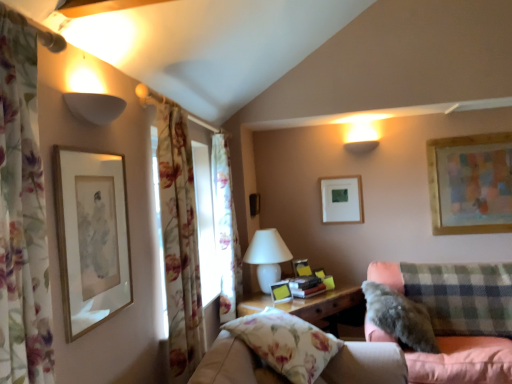
Describe the element at coordinates (225, 230) in the screenshot. I see `floral fabric curtain at center, marked as the third curtain in a front-to-back arrangement` at that location.

This screenshot has width=512, height=384. What do you see at coordinates (281, 292) in the screenshot? I see `matte yellow picture frame at center, the third picture frame in the back-to-front sequence` at bounding box center [281, 292].

Measure the distance between white matte lampshade at upper left and camera.

4.75 feet.

Find the location of a particular element. The width and height of the screenshot is (512, 384). floral fabric curtain at center, the second curtain viewed from the back is located at coordinates (179, 243).

What is the approximate width of floral fabric pillow at lower center, acting as the second studio couch starting from the back?

It is 16.93 inches.

Find the location of `white matte picture frame at upper center, marked as the second picture frame in a right-to-left arrangement`. white matte picture frame at upper center, marked as the second picture frame in a right-to-left arrangement is located at coordinates (341, 199).

Image resolution: width=512 pixels, height=384 pixels. What do you see at coordinates (341, 199) in the screenshot?
I see `white matte picture frame at upper center, the 1th picture frame when ordered from back to front` at bounding box center [341, 199].

Find the location of `floral fabric curtain at center, marked as the first curtain in a back-to-front arrangement`. floral fabric curtain at center, marked as the first curtain in a back-to-front arrangement is located at coordinates (225, 230).

Considering the sizes of objects floral fabric pillow at lower center, acting as the second studio couch starting from the back, and green checkered pillow at right in the image provided, who is bigger, floral fabric pillow at lower center, acting as the second studio couch starting from the back, or green checkered pillow at right?

With larger size is green checkered pillow at right.

Is floral fabric pillow at lower center, which ranks as the first studio couch in front-to-back order, far away from green checkered pillow at right?

Yes, floral fabric pillow at lower center, which ranks as the first studio couch in front-to-back order, and green checkered pillow at right are quite far apart.

Between floral fabric pillow at lower center, which appears as the 2th studio couch when viewed from the right, and green checkered pillow at right, which one appears on the left side from the viewer's perspective?

From the viewer's perspective, floral fabric pillow at lower center, which appears as the 2th studio couch when viewed from the right, appears more on the left side.

In order to click on studio couch above the green checkered pillow at right (from a real-world perspective) in this screenshot , I will do `click(366, 364)`.

In the image, is white ceramic table lamp at center positioned in front of or behind white matte lampshade at upper left?

white ceramic table lamp at center is behind white matte lampshade at upper left.

Does point (286, 258) come closer to viewer compared to point (83, 104)?

No, (286, 258) is further to viewer.

Does white ceramic table lamp at center have a greater width compared to white matte lampshade at upper left?

Yes, white ceramic table lamp at center is wider than white matte lampshade at upper left.

Looking at this image, is fluffy gray pillow at lower right wider or thinner than floral fabric curtain at left, the third curtain positioned from the back?

fluffy gray pillow at lower right is wider than floral fabric curtain at left, the third curtain positioned from the back.

Is fluffy gray pillow at lower right inside the boundaries of floral fabric curtain at left, the third curtain positioned from the back, or outside?

fluffy gray pillow at lower right lies outside floral fabric curtain at left, the third curtain positioned from the back.

Is fluffy gray pillow at lower right next to floral fabric curtain at left, the third curtain positioned from the back, and touching it?

No, fluffy gray pillow at lower right is not making contact with floral fabric curtain at left, the third curtain positioned from the back.

Does fluffy gray pillow at lower right lie in front of floral fabric curtain at left, the third curtain positioned from the back?

No, the depth of fluffy gray pillow at lower right is greater than that of floral fabric curtain at left, the third curtain positioned from the back.

Can you tell me how much floral fabric curtain at center, marked as the first curtain in a back-to-front arrangement, and white matte picture frame at upper center, which ranks as the 3th picture frame in left-to-right order, differ in facing direction?

94.2 degrees separate the facing orientations of floral fabric curtain at center, marked as the first curtain in a back-to-front arrangement, and white matte picture frame at upper center, which ranks as the 3th picture frame in left-to-right order.

Is floral fabric curtain at center, marked as the first curtain in a back-to-front arrangement, next to white matte picture frame at upper center, which ranks as the 3th picture frame in left-to-right order?

floral fabric curtain at center, marked as the first curtain in a back-to-front arrangement, and white matte picture frame at upper center, which ranks as the 3th picture frame in left-to-right order, are not in contact.

Consider the image. Is floral fabric curtain at center, marked as the first curtain in a back-to-front arrangement, oriented towards white matte picture frame at upper center, which ranks as the 3th picture frame in left-to-right order?

No, floral fabric curtain at center, marked as the first curtain in a back-to-front arrangement, does not turn towards white matte picture frame at upper center, which ranks as the 3th picture frame in left-to-right order.

Considering the sizes of objects floral fabric curtain at center, marked as the third curtain in a front-to-back arrangement, and white matte picture frame at upper center, the 1th picture frame when ordered from back to front, in the image provided, who is thinner, floral fabric curtain at center, marked as the third curtain in a front-to-back arrangement, or white matte picture frame at upper center, the 1th picture frame when ordered from back to front,?

white matte picture frame at upper center, the 1th picture frame when ordered from back to front.

From the image's perspective, which object appears higher, plaid fabric couch at lower right, the first studio couch when ordered from right to left, or white ceramic table lamp at center?

white ceramic table lamp at center appears higher in the image.

Is plaid fabric couch at lower right, the first studio couch when ordered from right to left, located outside white ceramic table lamp at center?

Yes.

Can you confirm if plaid fabric couch at lower right, the first studio couch when ordered from right to left, is shorter than white ceramic table lamp at center?

No.

Which is farther from the camera, (463, 371) or (273, 266)?

The point (273, 266) is farther from the camera.

Looking at this image, is floral fabric curtain at center, which appears as the 2th curtain when viewed from the front, positioned with its back to floral fabric curtain at left, the third curtain positioned from the back?

No, floral fabric curtain at center, which appears as the 2th curtain when viewed from the front, is not facing away from floral fabric curtain at left, the third curtain positioned from the back.

Consider the image. Can you confirm if floral fabric curtain at center, which appears as the 2th curtain when viewed from the front, is positioned to the right of floral fabric curtain at left, the third curtain positioned from the back?

Yes, floral fabric curtain at center, which appears as the 2th curtain when viewed from the front, is to the right of floral fabric curtain at left, the third curtain positioned from the back.

In the scene shown: How different are the orientations of floral fabric curtain at center, the second curtain viewed from the back, and floral fabric curtain at left, the third curtain positioned from the back, in degrees?

The angular difference between floral fabric curtain at center, the second curtain viewed from the back, and floral fabric curtain at left, the third curtain positioned from the back, is 0.000315 degrees.

Considering the sizes of objects floral fabric curtain at center, which appears as the 2th curtain when viewed from the front, and floral fabric curtain at left, which is the 1th curtain in front-to-back order, in the image provided, who is taller, floral fabric curtain at center, which appears as the 2th curtain when viewed from the front, or floral fabric curtain at left, which is the 1th curtain in front-to-back order,?

floral fabric curtain at center, which appears as the 2th curtain when viewed from the front.

Consider the image. From the image's perspective, is matte yellow picture frame at center, acting as the 2th picture frame starting from the left, on floral fabric curtain at center, the second curtain viewed from the back?

No.

Considering the positions of points (273, 299) and (164, 179), is point (273, 299) closer to camera compared to point (164, 179)?

No, (273, 299) is further to viewer.

Considering the relative positions of matte yellow picture frame at center, which is the third picture frame in right-to-left order, and floral fabric curtain at center, which appears as the 2th curtain when viewed from the front, in the image provided, is matte yellow picture frame at center, which is the third picture frame in right-to-left order, to the left of floral fabric curtain at center, which appears as the 2th curtain when viewed from the front, from the viewer's perspective?

In fact, matte yellow picture frame at center, which is the third picture frame in right-to-left order, is to the right of floral fabric curtain at center, which appears as the 2th curtain when viewed from the front.

You are a GUI agent. You are given a task and a screenshot of the screen. Output one action in this format:
    pyautogui.click(x=<x>, y=<y>)
    Task: Click on the 2nd studio couch to the left when counting from the green checkered pillow at right
    
    Given the screenshot: What is the action you would take?
    pyautogui.click(x=366, y=364)

Locate an element on the screen. lamp that is in front of the white ceramic table lamp at center is located at coordinates (95, 107).

Based on their spatial positions, is floral fabric curtain at center, marked as the third curtain in a front-to-back arrangement, or floral fabric curtain at center, the second curtain viewed from the back, closer to wooden-framed artwork at upper right, placed as the second picture frame when sorted from back to front?

floral fabric curtain at center, marked as the third curtain in a front-to-back arrangement, lies closer to wooden-framed artwork at upper right, placed as the second picture frame when sorted from back to front, than the other object.

Estimate the real-world distances between objects in this image. Which object is further from plaid fabric couch at lower right, which is the first studio couch in back-to-front order, floral fabric curtain at center, the second curtain viewed from the back, or green checkered pillow at right?

The object further to plaid fabric couch at lower right, which is the first studio couch in back-to-front order, is floral fabric curtain at center, the second curtain viewed from the back.

Estimate the real-world distances between objects in this image. Which object is further from green checkered pillow at right, floral fabric curtain at left, the third curtain positioned from the back, or floral fabric curtain at center, the second curtain viewed from the back?

The object further to green checkered pillow at right is floral fabric curtain at left, the third curtain positioned from the back.

Considering their positions, is floral fabric pillow at lower center, acting as the second studio couch starting from the back, positioned closer to matte yellow picture frame at center, acting as the second picture frame starting from the front, than wooden-framed artwork at upper right, which is the first picture frame in right-to-left order?

Based on the image, floral fabric pillow at lower center, acting as the second studio couch starting from the back, appears to be nearer to matte yellow picture frame at center, acting as the second picture frame starting from the front.

Which object lies nearer to the anchor point floral fabric curtain at left, the third curtain positioned from the back, gold-framed artwork at upper left, which is the 1th picture frame in left-to-right order, or floral fabric pillow at lower center, the first studio couch in the left-to-right sequence?

gold-framed artwork at upper left, which is the 1th picture frame in left-to-right order.

When comparing their distances from white matte lampshade at upper left, does floral fabric curtain at center, the second curtain viewed from the back, or plaid fabric couch at lower right, marked as the 2th studio couch in a left-to-right arrangement, seem further?

plaid fabric couch at lower right, marked as the 2th studio couch in a left-to-right arrangement.

When comparing their distances from white matte lampshade at upper left, does fluffy gray pillow at lower right or floral fabric curtain at center, marked as the third curtain in a front-to-back arrangement, seem further?

fluffy gray pillow at lower right is further to white matte lampshade at upper left.

Estimate the real-world distances between objects in this image. Which object is closer to floral fabric curtain at center, marked as the third curtain in a front-to-back arrangement, white matte lampshade at upper left or fluffy gray pillow at lower right?

fluffy gray pillow at lower right is closer to floral fabric curtain at center, marked as the third curtain in a front-to-back arrangement.

This screenshot has width=512, height=384. I want to click on studio couch situated between floral fabric curtain at center, marked as the third curtain in a front-to-back arrangement, and plaid fabric couch at lower right, the first studio couch when ordered from right to left, from left to right, so click(x=366, y=364).

I want to click on pillow between floral fabric curtain at left, the third curtain positioned from the back, and floral fabric curtain at center, marked as the third curtain in a front-to-back arrangement, in the front-back direction, so click(x=400, y=317).

Find the location of a particular element. Image resolution: width=512 pixels, height=384 pixels. pillow between floral fabric curtain at left, the third curtain positioned from the back, and white matte picture frame at upper center, which ranks as the 3th picture frame in left-to-right order, from front to back is located at coordinates (400, 317).

The width and height of the screenshot is (512, 384). In order to click on table lamp positioned between gold-framed artwork at upper left, the 1th picture frame positioned from the front, and white matte picture frame at upper center, which is counted as the fourth picture frame, starting from the front, from near to far in this screenshot , I will do `click(267, 256)`.